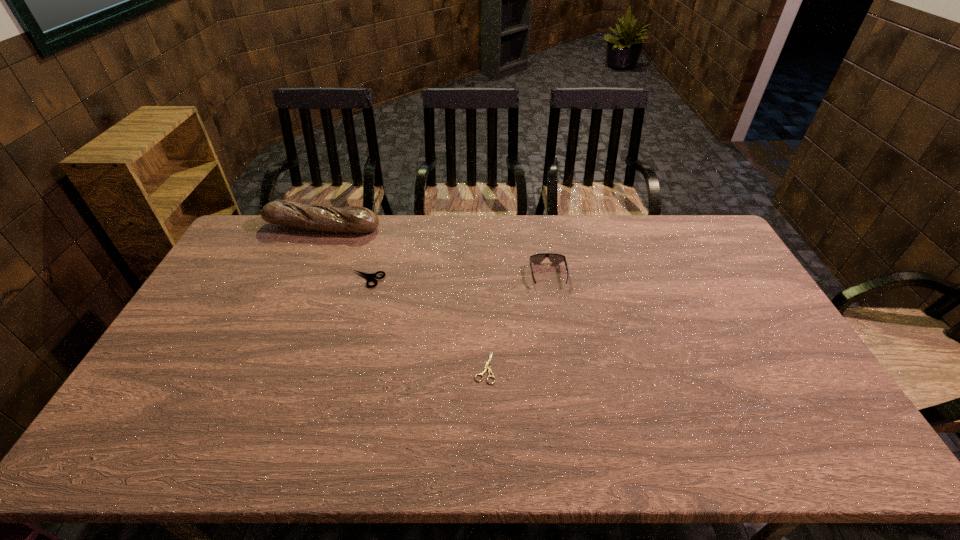
The width and height of the screenshot is (960, 540). I want to click on object that stands as the closest to the farthest object, so click(368, 276).

At what (x,y) coordinates should I click in order to perform the action: click on free space in the image that satisfies the following two spatial constraints: 1. on the front side of the farthest object; 2. on the right side of the shortest object. Please return your answer as a coordinate pair (x, y). Looking at the image, I should click on (260, 368).

You are a GUI agent. You are given a task and a screenshot of the screen. Output one action in this format:
    pyautogui.click(x=<x>, y=<y>)
    Task: Click on the vacant point that satisfies the following two spatial constraints: 1. on the front side of the baguet; 2. on the right side of the taller shears
    The width and height of the screenshot is (960, 540).
    Given the screenshot: What is the action you would take?
    pyautogui.click(x=300, y=279)